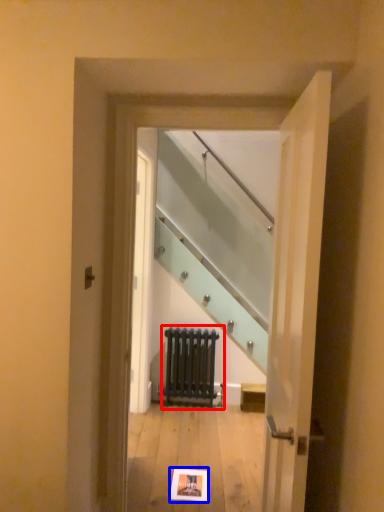
Question: Which object is further to the camera taking this photo, radiator (highlighted by a red box) or postcard (highlighted by a blue box)?

Choices:
 (A) radiator
 (B) postcard

Answer: (A)